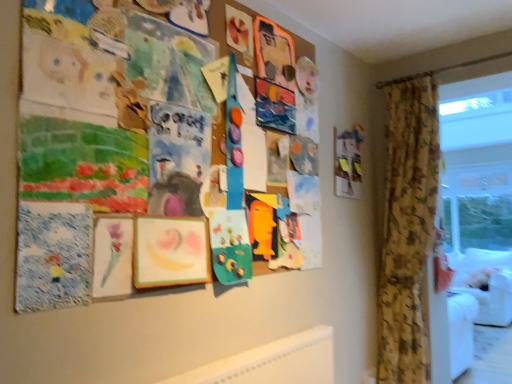
What do you see at coordinates (407, 228) in the screenshot? I see `floral fabric curtain at right` at bounding box center [407, 228].

Find the location of a particular element. white fabric couch at right is located at coordinates (485, 282).

Locate an element on the screen. The height and width of the screenshot is (384, 512). floral fabric curtain at right is located at coordinates (407, 228).

Is transparent plastic window screen at right directly adjacent to wooden picture frame at upper right?

No, transparent plastic window screen at right is not beside wooden picture frame at upper right.

From the image's perspective, between transparent plastic window screen at right and wooden picture frame at upper right, who is located below?

transparent plastic window screen at right, from the image's perspective.

Considering the sizes of objects transparent plastic window screen at right and wooden picture frame at upper right in the image provided, who is thinner, transparent plastic window screen at right or wooden picture frame at upper right?

wooden picture frame at upper right.

From the image's perspective, is floral fabric curtain at right beneath white fabric couch at right?

Incorrect, from the image's perspective, floral fabric curtain at right is higher than white fabric couch at right.

Is the position of floral fabric curtain at right more distant than that of white fabric couch at right?

No, it is not.

Between floral fabric curtain at right and white fabric couch at right, which one appears on the right side from the viewer's perspective?

white fabric couch at right.

Based on the photo, is floral fabric curtain at right looking in the opposite direction of white fabric couch at right?

That's right, floral fabric curtain at right is facing away from white fabric couch at right.

Considering the relative positions of wooden picture frame at upper right and white fabric couch at right in the image provided, is wooden picture frame at upper right to the right of white fabric couch at right from the viewer's perspective?

No, wooden picture frame at upper right is not to the right of white fabric couch at right.

Considering the relative sizes of wooden picture frame at upper right and white fabric couch at right in the image provided, is wooden picture frame at upper right bigger than white fabric couch at right?

Incorrect, wooden picture frame at upper right is not larger than white fabric couch at right.

Is wooden picture frame at upper right thinner than white fabric couch at right?

Correct, the width of wooden picture frame at upper right is less than that of white fabric couch at right.

Consider the image. Is wooden picture frame at upper right looking in the opposite direction of white fabric couch at right?

No.

From the image's perspective, which is above, floral fabric curtain at right or wooden picture frame at upper right?

wooden picture frame at upper right, from the image's perspective.

Which object is positioned more to the left, floral fabric curtain at right or wooden picture frame at upper right?

wooden picture frame at upper right.

Does floral fabric curtain at right have a lesser height compared to wooden picture frame at upper right?

Incorrect, the height of floral fabric curtain at right does not fall short of that of wooden picture frame at upper right.

From a real-world perspective, between floral fabric curtain at right and wooden picture frame at upper right, who is vertically higher?

wooden picture frame at upper right.

Can you confirm if white fabric couch at right is positioned to the left of transparent plastic window screen at right?

Yes, white fabric couch at right is to the left of transparent plastic window screen at right.

Would you consider white fabric couch at right to be distant from transparent plastic window screen at right?

That's not correct — white fabric couch at right is a little close to transparent plastic window screen at right.

Considering the sizes of objects white fabric couch at right and transparent plastic window screen at right in the image provided, who is taller, white fabric couch at right or transparent plastic window screen at right?

Standing taller between the two is transparent plastic window screen at right.

Is floral fabric curtain at right at the back of white fabric couch at right?

white fabric couch at right does not have its back to floral fabric curtain at right.

Is white fabric couch at right at the right side of floral fabric curtain at right?

Yes.

Is white fabric couch at right next to floral fabric curtain at right and touching it?

There is a gap between white fabric couch at right and floral fabric curtain at right.

Based on their sizes in the image, would you say floral fabric curtain at right is bigger or smaller than transparent plastic window screen at right?

Considering their sizes, floral fabric curtain at right takes up more space than transparent plastic window screen at right.

Is the surface of floral fabric curtain at right in direct contact with transparent plastic window screen at right?

No, floral fabric curtain at right is not touching transparent plastic window screen at right.

Does point (429, 176) come behind point (511, 216)?

No.

Between floral fabric curtain at right and transparent plastic window screen at right, which one is positioned in front?

floral fabric curtain at right is more forward.

This screenshot has width=512, height=384. Find the location of `window screen beneath the wooden picture frame at upper right (from a real-world perspective)`. window screen beneath the wooden picture frame at upper right (from a real-world perspective) is located at coordinates (478, 206).

You are a GUI agent. You are given a task and a screenshot of the screen. Output one action in this format:
    pyautogui.click(x=<x>, y=<y>)
    Task: Click on the curtain that appears above the white fabric couch at right (from a real-world perspective)
    The height and width of the screenshot is (384, 512).
    Given the screenshot: What is the action you would take?
    pyautogui.click(x=407, y=228)

Based on their spatial positions, is white fabric couch at right or wooden picture frame at upper right further from floral fabric curtain at right?

white fabric couch at right is further to floral fabric curtain at right.

Considering their positions, is white fabric couch at right positioned closer to wooden picture frame at upper right than transparent plastic window screen at right?

The object closer to wooden picture frame at upper right is transparent plastic window screen at right.

From the picture: Which object lies nearer to the anchor point wooden picture frame at upper right, transparent plastic window screen at right or floral fabric curtain at right?

floral fabric curtain at right is closer to wooden picture frame at upper right.

When comparing their distances from wooden picture frame at upper right, does white fabric couch at right or floral fabric curtain at right seem further?

white fabric couch at right lies further to wooden picture frame at upper right than the other object.

Which object lies further to the anchor point transparent plastic window screen at right, white fabric couch at right or wooden picture frame at upper right?

→ wooden picture frame at upper right is further to transparent plastic window screen at right.

Looking at the image, which one is located closer to floral fabric curtain at right, white fabric couch at right or transparent plastic window screen at right?

Based on the image, white fabric couch at right appears to be nearer to floral fabric curtain at right.

From the image, which object appears to be nearer to wooden picture frame at upper right, floral fabric curtain at right or transparent plastic window screen at right?

floral fabric curtain at right is closer to wooden picture frame at upper right.

From the image, which object appears to be farther from white fabric couch at right, transparent plastic window screen at right or floral fabric curtain at right?

floral fabric curtain at right.

This screenshot has width=512, height=384. Find the location of `picture frame between floral fabric curtain at right and white fabric couch at right from front to back`. picture frame between floral fabric curtain at right and white fabric couch at right from front to back is located at coordinates (348, 162).

This screenshot has width=512, height=384. I want to click on picture frame between floral fabric curtain at right and transparent plastic window screen at right from front to back, so click(348, 162).

Identify the location of couch located between wooden picture frame at upper right and transparent plastic window screen at right in the depth direction. (485, 282).

The width and height of the screenshot is (512, 384). I want to click on couch positioned between floral fabric curtain at right and transparent plastic window screen at right from near to far, so click(x=485, y=282).